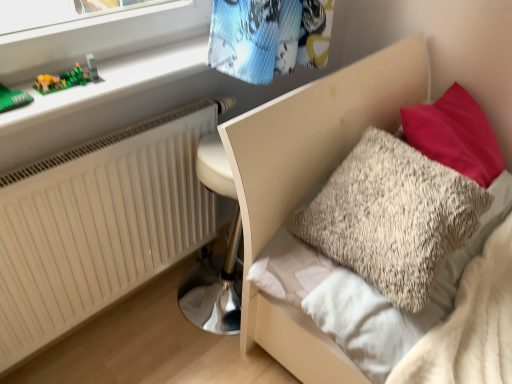
Question: Is fluffy beige pillow at upper right surrounding green plastic blocks at upper left?

Choices:
 (A) no
 (B) yes

Answer: (A)

Question: From the image's perspective, is fluffy beige pillow at upper right located beneath green plastic blocks at upper left?

Choices:
 (A) yes
 (B) no

Answer: (A)

Question: Is fluffy beige pillow at upper right touching green plastic blocks at upper left?

Choices:
 (A) yes
 (B) no

Answer: (B)

Question: Is fluffy beige pillow at upper right facing towards green plastic blocks at upper left?

Choices:
 (A) yes
 (B) no

Answer: (B)

Question: From the image's perspective, does fluffy beige pillow at upper right appear higher than green plastic blocks at upper left?

Choices:
 (A) no
 (B) yes

Answer: (A)

Question: Is fluffy beige pillow at upper right not close to green plastic blocks at upper left?

Choices:
 (A) no
 (B) yes

Answer: (A)

Question: Can you confirm if green plastic blocks at upper left is thinner than white matte radiator at lower left?

Choices:
 (A) no
 (B) yes

Answer: (A)

Question: Is green plastic blocks at upper left bigger than white matte radiator at lower left?

Choices:
 (A) no
 (B) yes

Answer: (A)

Question: From a real-world perspective, is green plastic blocks at upper left on white matte radiator at lower left?

Choices:
 (A) yes
 (B) no

Answer: (A)

Question: From the image's perspective, is green plastic blocks at upper left beneath white matte radiator at lower left?

Choices:
 (A) yes
 (B) no

Answer: (B)

Question: Can white matte radiator at lower left be found inside green plastic blocks at upper left?

Choices:
 (A) yes
 (B) no

Answer: (B)

Question: Is green plastic blocks at upper left facing towards white matte radiator at lower left?

Choices:
 (A) no
 (B) yes

Answer: (A)

Question: From a real-world perspective, is green plastic toy at upper left physically above white matte radiator at lower left?

Choices:
 (A) no
 (B) yes

Answer: (B)